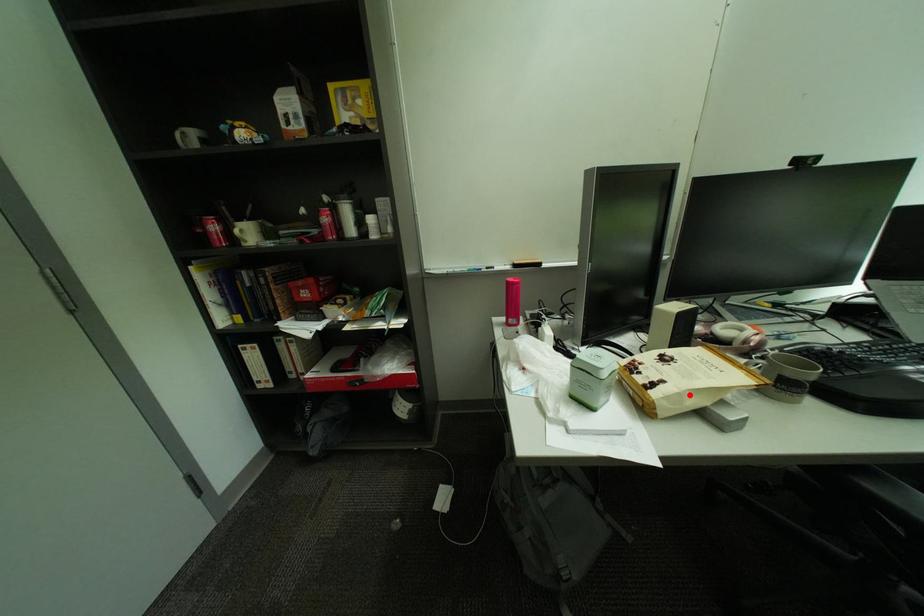
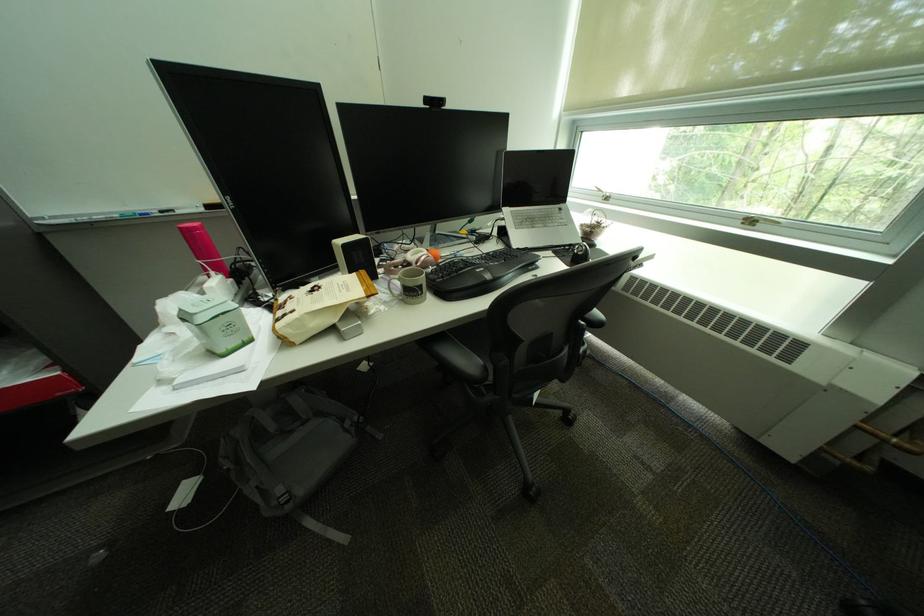
In the second image, find the point that corresponds to the highlighted location in the first image.

(309, 321)